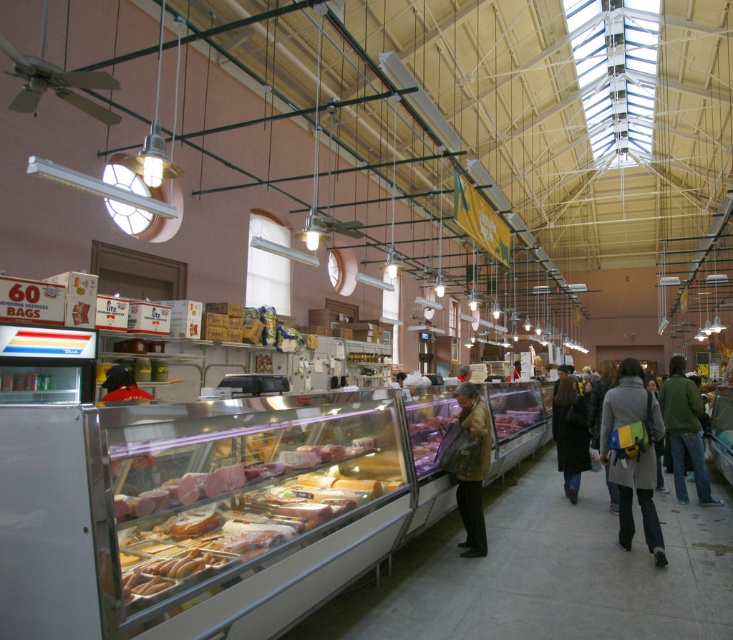
Between point (658, 412) and point (471, 497), which one is positioned behind?

The point (471, 497) is behind.

Does gray fabric coat at center appear on the left side of brown textured coat at center?

In fact, gray fabric coat at center is to the right of brown textured coat at center.

Which is in front, point (626, 512) or point (486, 456)?

Point (486, 456)

Locate an element on the screen. gray fabric coat at center is located at coordinates (633, 452).

Who is positioned more to the left, gray fabric coat at center or dark brown coat at center?

gray fabric coat at center

Does point (627, 477) come behind point (564, 419)?

No.

Locate an element on the screen. gray fabric coat at center is located at coordinates (633, 452).

Does smooth pink meat at center appear over dark brown leather jacket at center?

Yes, smooth pink meat at center is above dark brown leather jacket at center.

Is smooth pink meat at center thinner than dark brown leather jacket at center?

Incorrect, smooth pink meat at center's width is not less than dark brown leather jacket at center's.

Locate an element on the screen. This screenshot has width=733, height=640. smooth pink meat at center is located at coordinates (509, 422).